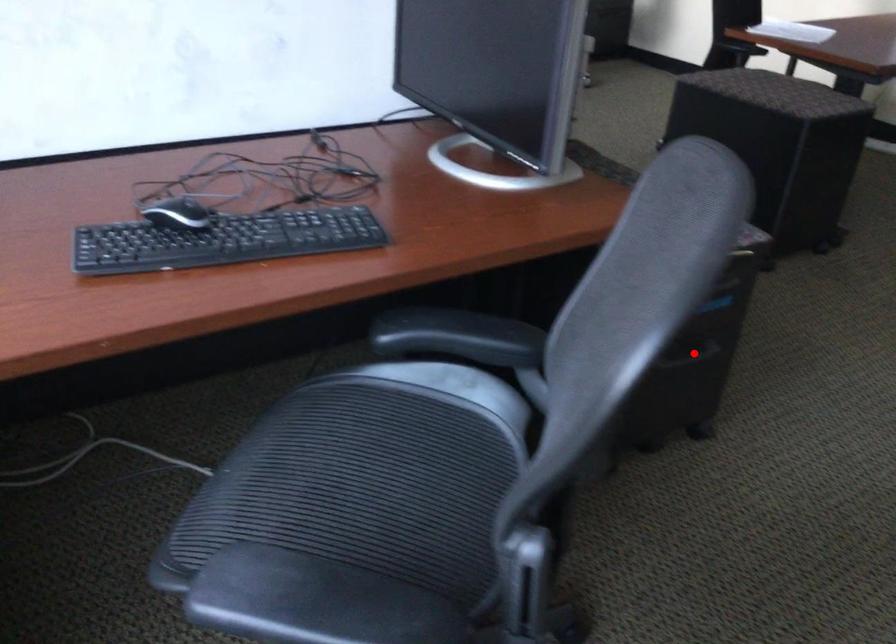
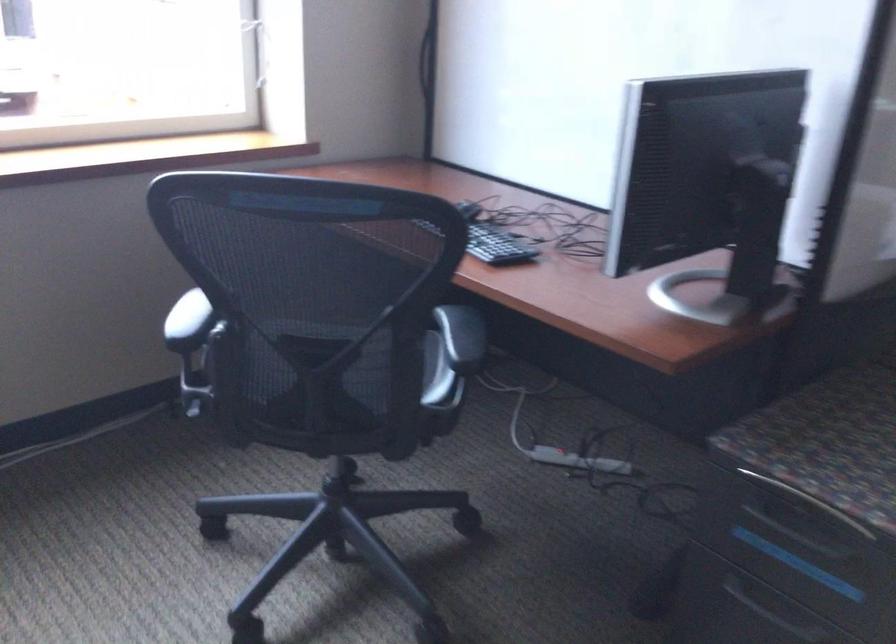
In the second image, find the point that corresponds to the highlighted location in the first image.

(778, 614)